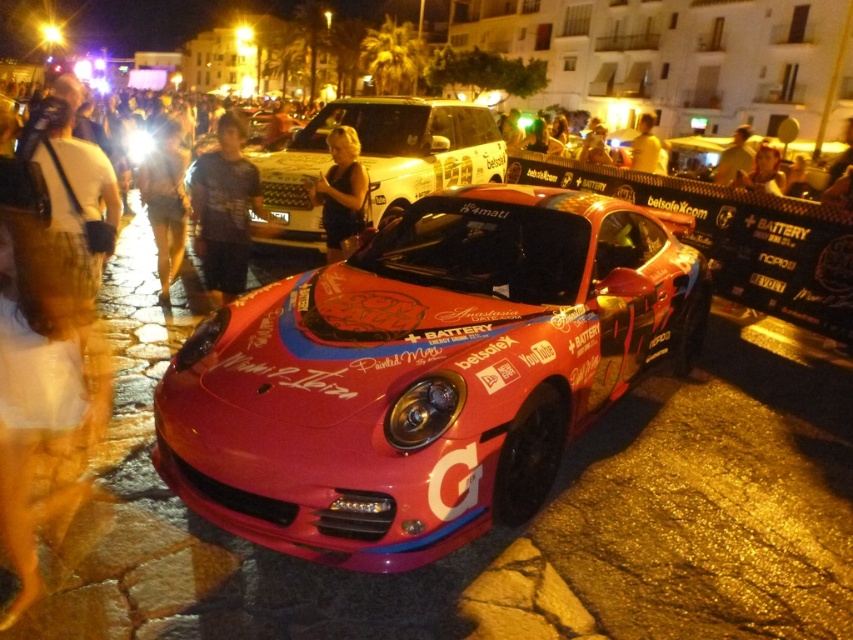
You are a photographer standing at the camera position. You want to take a photo of the dark brown leather jacket at center without moving the car. Can you reach the jacket to adjust its position for a better shot?

The dark brown leather jacket at center is 5.77 meters away from the camera, so you can reach it without moving the car to adjust its position for a better shot.

You are a photographer at the event and want to take a photo that includes both the dark brown leather jacket at center and the smooth skin face at upper right. Which object should you focus on first to ensure both are in sharp focus?

You should focus on the dark brown leather jacket at center first because it is closer to the viewer than the smooth skin face at upper right. By focusing on the closer object, the farther one may still be in focus depending on the depth of field.

You are a photographer at the event and want to capture both the dark brown leather jacket at center and the smooth skin face at upper right in the same frame. Which object should you focus on first to ensure both are in focus?

The dark brown leather jacket at center has a greater height compared to smooth skin face at upper right. Therefore, focusing on the dark brown leather jacket at center first will help ensure both objects are in focus since it is taller and likely further away.